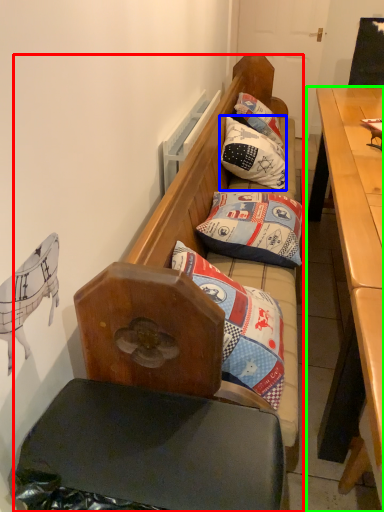
Question: Estimate the real-world distances between objects in this image. Which object is farther from studio couch (highlighted by a red box), pillow (highlighted by a blue box) or desk (highlighted by a green box)?

Choices:
 (A) pillow
 (B) desk

Answer: (A)